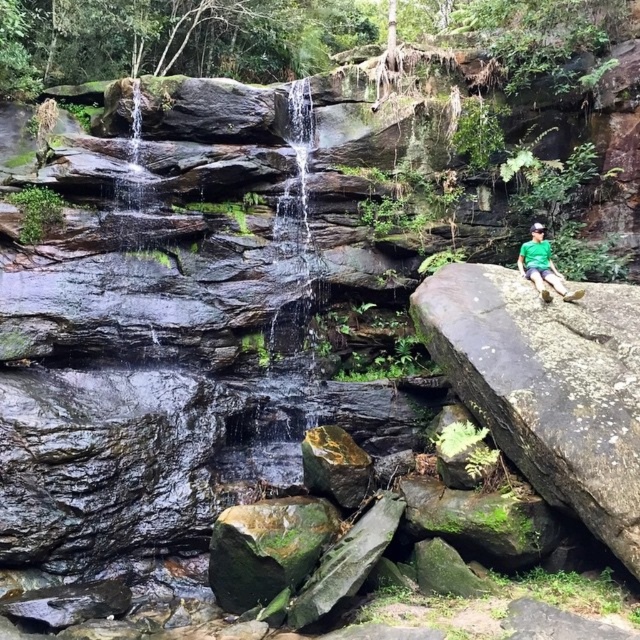
You are a photographer standing at the edge of the water. You want to take a photo of the green mossy rock at right and the green fabric shirt at right. The minimum distance between them should be 30 inches to avoid overlapping in the shot. Is the current distance sufficient?

The green mossy rock at right and green fabric shirt at right are 27.41 inches apart, which is less than the required 30 inches. Therefore, the current distance is insufficient to avoid overlapping in the photo.

You are standing at the edge of the waterfall and want to reach the green mossy rock at right. The person is seated on the rock. Considering the distance between you and the rock, can you safely throw a small pebble to hit the rock without disturbing the person?

The distance between you and the green mossy rock at right is 4.52 meters. Since the person is seated on the rock, throwing a pebble that far might be challenging and could potentially disturb them. It is advisable to approach quietly instead.

In the scene shown: You are standing in the scene and want to place a small backpack between the green mossy rock at right and the green fabric shirt at right. Which object should you place it closer to if you want the backpack to be visible from your current position?

You should place the backpack closer to the green mossy rock at right because it is closer to the viewer than the green fabric shirt at right, making it more visible from your current position.